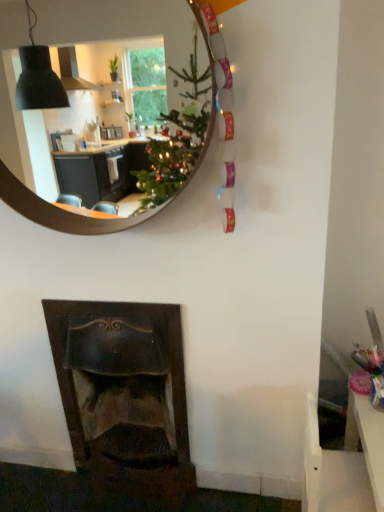
Question: Does white plastic table at lower right have a greater width compared to wooden mirror at upper center?

Choices:
 (A) yes
 (B) no

Answer: (A)

Question: From the image's perspective, is white plastic table at lower right located beneath wooden mirror at upper center?

Choices:
 (A) no
 (B) yes

Answer: (B)

Question: From a real-world perspective, is white plastic table at lower right located beneath wooden mirror at upper center?

Choices:
 (A) no
 (B) yes

Answer: (B)

Question: Is white plastic table at lower right not inside wooden mirror at upper center?

Choices:
 (A) no
 (B) yes

Answer: (B)

Question: Does white plastic table at lower right appear on the left side of wooden mirror at upper center?

Choices:
 (A) no
 (B) yes

Answer: (A)

Question: Can you confirm if white plastic table at lower right is smaller than wooden mirror at upper center?

Choices:
 (A) yes
 (B) no

Answer: (B)

Question: Is dark wood fireplace at lower left positioned with its back to white plastic table at lower right?

Choices:
 (A) no
 (B) yes

Answer: (A)

Question: Can you confirm if dark wood fireplace at lower left is positioned to the left of white plastic table at lower right?

Choices:
 (A) no
 (B) yes

Answer: (B)

Question: Is dark wood fireplace at lower left in contact with white plastic table at lower right?

Choices:
 (A) yes
 (B) no

Answer: (B)

Question: From the image's perspective, is dark wood fireplace at lower left beneath white plastic table at lower right?

Choices:
 (A) no
 (B) yes

Answer: (A)

Question: Considering the relative sizes of dark wood fireplace at lower left and white plastic table at lower right in the image provided, is dark wood fireplace at lower left smaller than white plastic table at lower right?

Choices:
 (A) yes
 (B) no

Answer: (B)

Question: Would you say dark wood fireplace at lower left is outside white plastic table at lower right?

Choices:
 (A) yes
 (B) no

Answer: (A)

Question: Is white plastic table at lower right outside of dark wood fireplace at lower left?

Choices:
 (A) yes
 (B) no

Answer: (A)